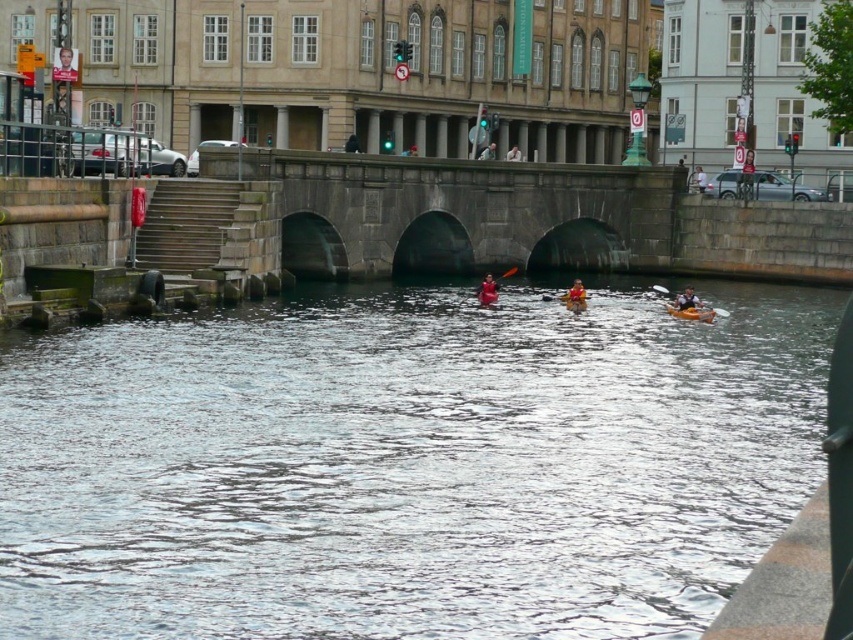
You are planning to take a boat ride on the canal. You see a red fabric kayak at center and a yellow plastic canoe at center. Which one can you fit more people in?

The red fabric kayak at center has a larger width than the yellow plastic canoe at center, so it can fit more people.

You are standing on the stone bridge and see the yellow plastic canoe at center and the light brown wooden paddle at center in the water below. Which object is closer to you?

The yellow plastic canoe at center is closer to you than the light brown wooden paddle at center.